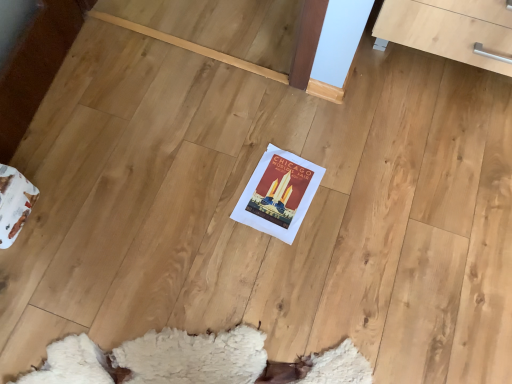
The height and width of the screenshot is (384, 512). Find the location of `vacant area that is in front of white paper magazine at center`. vacant area that is in front of white paper magazine at center is located at coordinates 276,263.